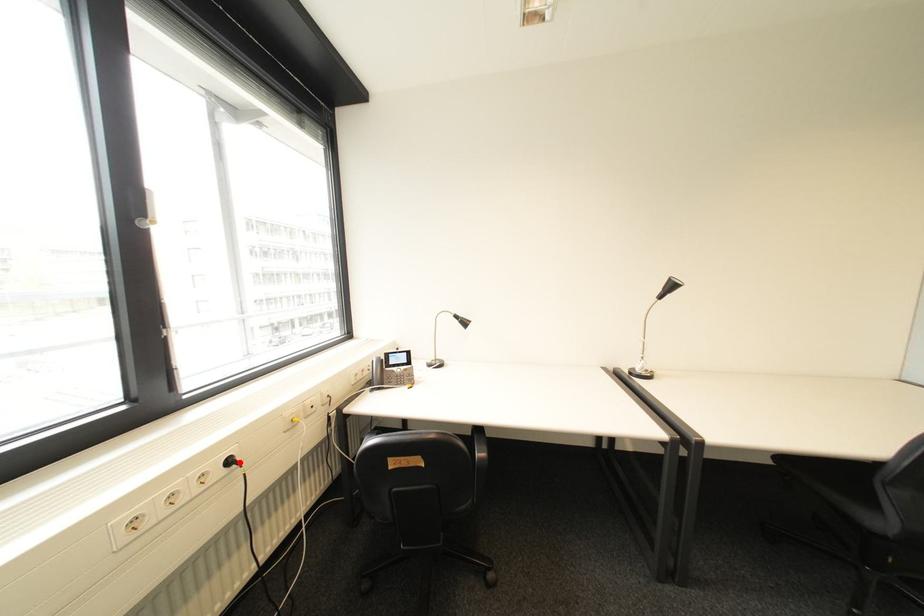
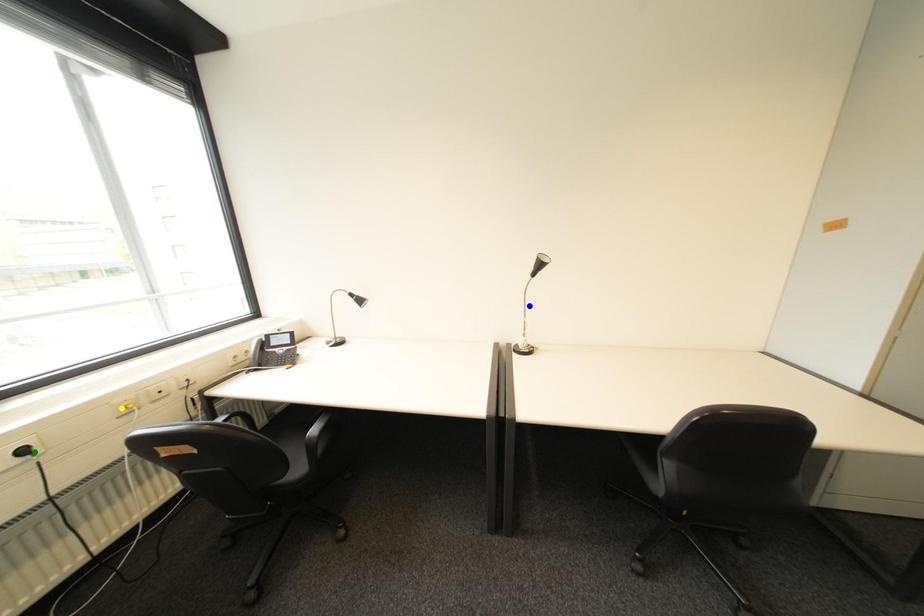
Question: I am providing you with two images of the same scene from different viewpoints. A red point is marked on the first image. You are given multiple points on the second image. In image 2, which mark is for the same physical point as the one in image 1?

Choices:
 (A) yellow point
 (B) blue point
 (C) green point

Answer: (C)